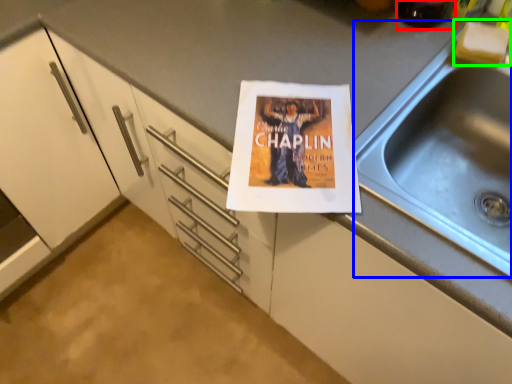
Question: Which is farther away from beverage (highlighted by a red box)? sink (highlighted by a blue box) or food (highlighted by a green box)?

Choices:
 (A) sink
 (B) food

Answer: (A)